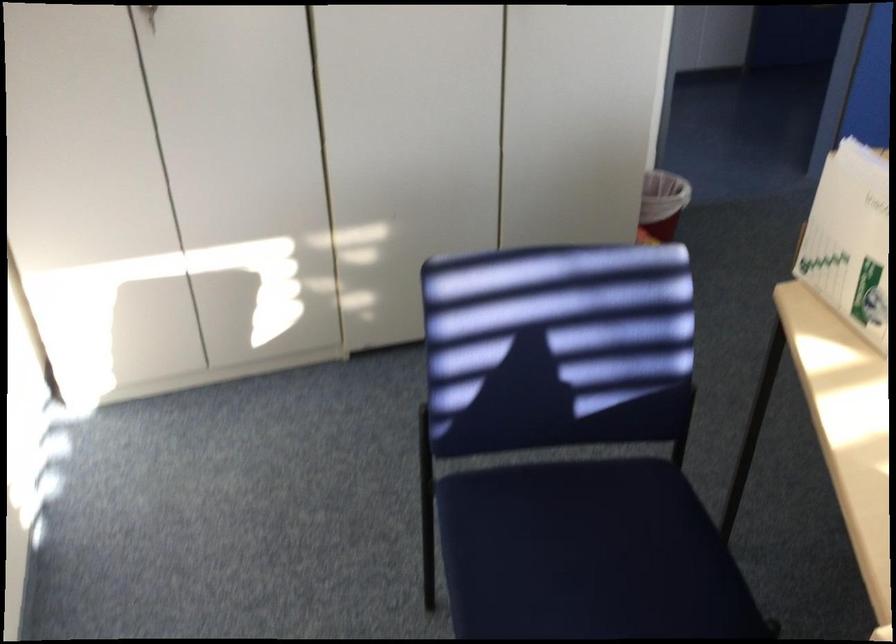
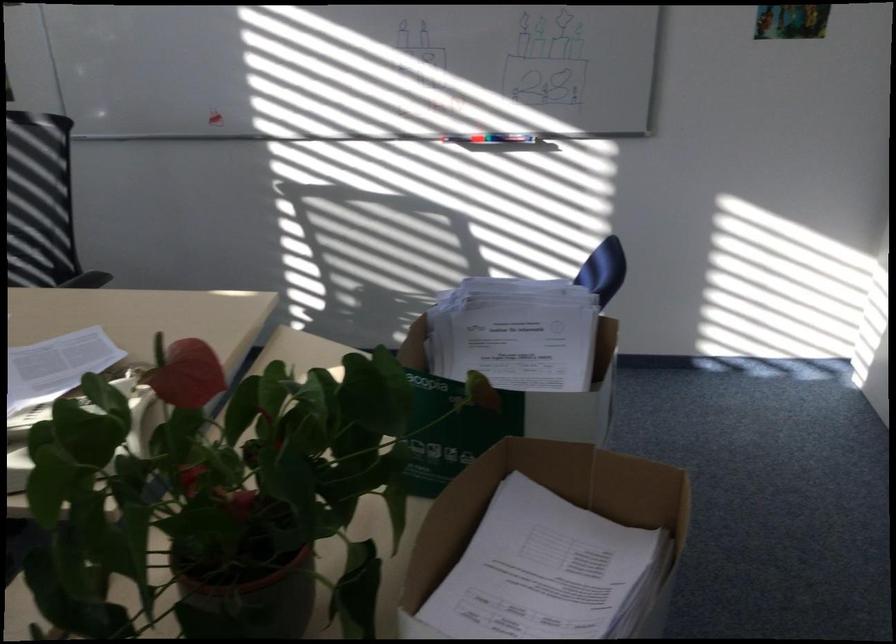
Question: I am providing you with two images of the same scene from different viewpoints. Which of the following objects are not visible in image2?

Choices:
 (A) phone keypad buttons
 (B) brown plant pot
 (C) blue chair sitting surface
 (D) chair sitting surface

Answer: (C)